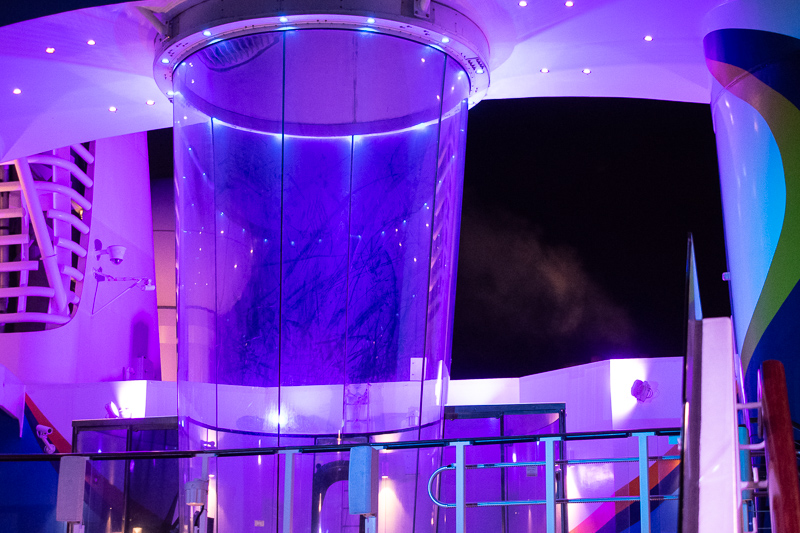
Find the location of `security camera`. security camera is located at coordinates (38, 438), (112, 260).